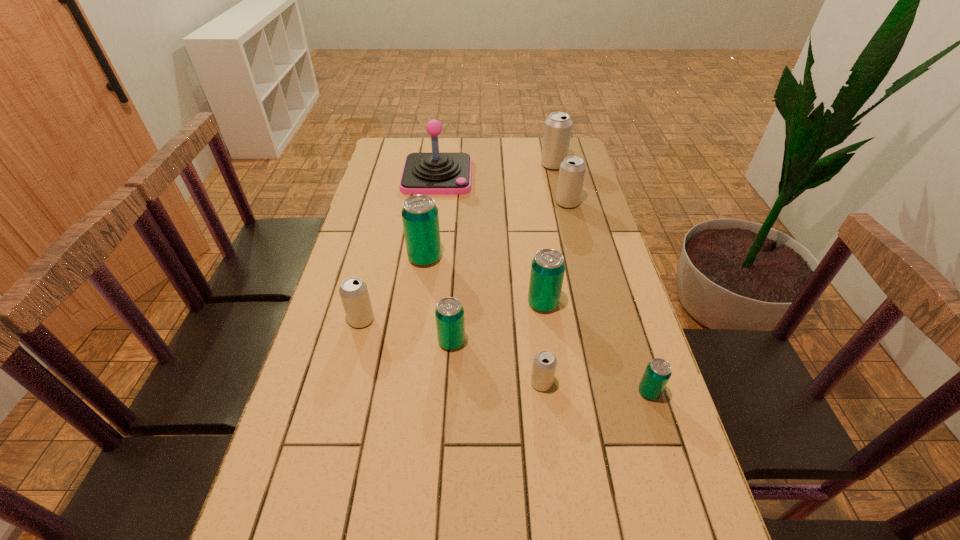
This screenshot has width=960, height=540. I want to click on unoccupied area between the second biggest teal beer can and the third white beer can from right to left, so click(542, 343).

This screenshot has width=960, height=540. I want to click on vacant space that is in between the leftmost white beer can and the sixth beer can from right to left, so click(406, 330).

You are a GUI agent. You are given a task and a screenshot of the screen. Output one action in this format:
    pyautogui.click(x=<x>, y=<y>)
    Task: Click on the free area in between the leftmost beer can and the third white beer can from right to left
    Image resolution: width=960 pixels, height=540 pixels.
    Given the screenshot: What is the action you would take?
    pyautogui.click(x=451, y=352)

Where is `object that can be found as the eighth closest to the rightmost object`? The image size is (960, 540). object that can be found as the eighth closest to the rightmost object is located at coordinates (557, 131).

Identify which object is located as the sixth nearest to the leftmost teal beer can. Please provide its 2D coordinates. Your answer should be formatted as a tuple, i.e. [(x, y)], where the tuple contains the x and y coordinates of a point satisfying the conditions above.

[(544, 365)]

Identify which beer can is located as the nearest to the farthest beer can. Please provide its 2D coordinates. Your answer should be formatted as a tuple, i.e. [(x, y)], where the tuple contains the x and y coordinates of a point satisfying the conditions above.

[(572, 170)]

Locate an element on the screen. beer can that is the third closest to the pink joystick is located at coordinates (572, 170).

Identify the location of the fourth closest white beer can to the joystick. (544, 365).

I want to click on white beer can that can be found as the second closest to the second smallest white beer can, so click(572, 170).

You are a GUI agent. You are given a task and a screenshot of the screen. Output one action in this format:
    pyautogui.click(x=<x>, y=<y>)
    Task: Click on the teal beer can that can be found as the fourth closest to the biggest white beer can
    Image resolution: width=960 pixels, height=540 pixels.
    Given the screenshot: What is the action you would take?
    pyautogui.click(x=658, y=372)